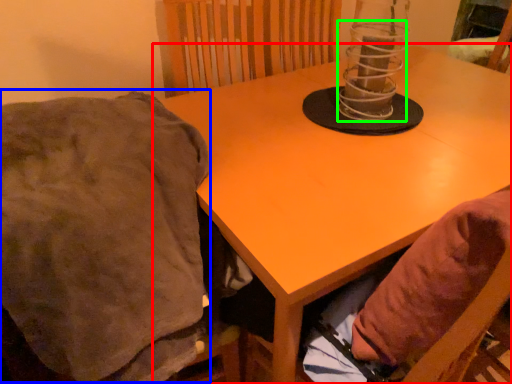
Question: Considering the real-world distances, which object is closest to table (highlighted by a red box)? blanket (highlighted by a blue box) or candle holder (highlighted by a green box).

Choices:
 (A) blanket
 (B) candle holder

Answer: (B)